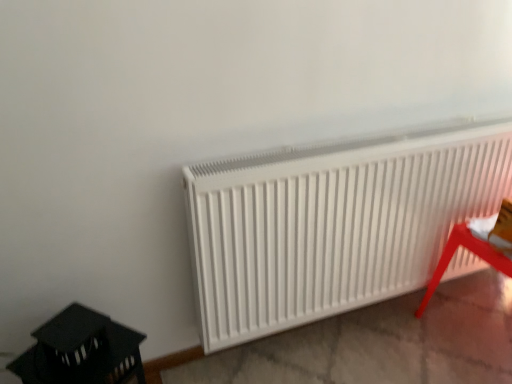
Question: From the image's perspective, is black plastic lantern at lower left, which is the second furniture from right to left, above white matte radiator at center?

Choices:
 (A) no
 (B) yes

Answer: (A)

Question: From a real-world perspective, is black plastic lantern at lower left, which appears as the 1th furniture when viewed from the left, physically above white matte radiator at center?

Choices:
 (A) yes
 (B) no

Answer: (B)

Question: Is black plastic lantern at lower left, which is the second furniture from right to left, aimed at white matte radiator at center?

Choices:
 (A) yes
 (B) no

Answer: (B)

Question: From a real-world perspective, is black plastic lantern at lower left, which appears as the 1th furniture when viewed from the left, physically below white matte radiator at center?

Choices:
 (A) yes
 (B) no

Answer: (A)

Question: Is black plastic lantern at lower left, which appears as the 1th furniture when viewed from the left, positioned before white matte radiator at center?

Choices:
 (A) yes
 (B) no

Answer: (A)

Question: Considering the relative sizes of black plastic lantern at lower left, which appears as the 1th furniture when viewed from the left, and white matte radiator at center in the image provided, is black plastic lantern at lower left, which appears as the 1th furniture when viewed from the left, thinner than white matte radiator at center?

Choices:
 (A) yes
 (B) no

Answer: (B)

Question: From the image's perspective, does metallic red stool at lower right, which is the second furniture in left-to-right order, appear higher than white matte radiator at center?

Choices:
 (A) no
 (B) yes

Answer: (A)

Question: Could white matte radiator at center be considered to be inside metallic red stool at lower right, which is counted as the 1th furniture, starting from the right?

Choices:
 (A) no
 (B) yes

Answer: (A)

Question: Is metallic red stool at lower right, which is counted as the 1th furniture, starting from the right, outside of white matte radiator at center?

Choices:
 (A) yes
 (B) no

Answer: (A)

Question: Is metallic red stool at lower right, which is counted as the 1th furniture, starting from the right, smaller than white matte radiator at center?

Choices:
 (A) no
 (B) yes

Answer: (B)

Question: From the image's perspective, does metallic red stool at lower right, which is the second furniture in left-to-right order, appear lower than white matte radiator at center?

Choices:
 (A) yes
 (B) no

Answer: (A)

Question: Is metallic red stool at lower right, which is the second furniture in left-to-right order, to the left of white matte radiator at center from the viewer's perspective?

Choices:
 (A) no
 (B) yes

Answer: (A)

Question: Is white matte radiator at center behind metallic red stool at lower right, which is the second furniture in left-to-right order?

Choices:
 (A) no
 (B) yes

Answer: (A)